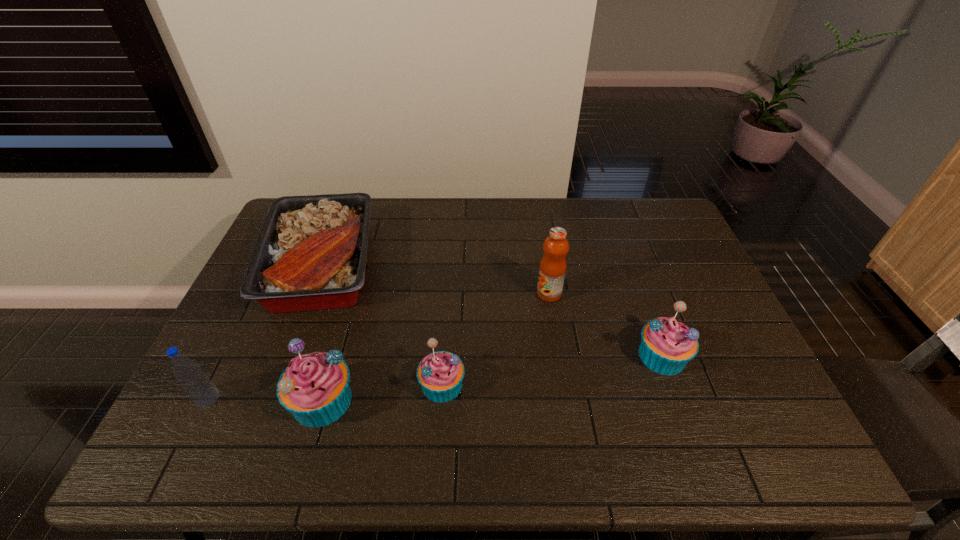
The image size is (960, 540). In order to click on the leftmost muffin in this screenshot , I will do `click(314, 387)`.

You are a GUI agent. You are given a task and a screenshot of the screen. Output one action in this format:
    pyautogui.click(x=<x>, y=<y>)
    Task: Click on the second muffin from right to left
    The width and height of the screenshot is (960, 540).
    Given the screenshot: What is the action you would take?
    pyautogui.click(x=440, y=374)

Where is `the third object from right to left`? This screenshot has width=960, height=540. the third object from right to left is located at coordinates (440, 374).

Find the location of a particular element. This screenshot has width=960, height=540. the rightmost muffin is located at coordinates (667, 345).

The height and width of the screenshot is (540, 960). I want to click on the rightmost object, so click(667, 345).

Locate an element on the screen. The height and width of the screenshot is (540, 960). fruit juice is located at coordinates (552, 270).

Where is `the tallest object`? the tallest object is located at coordinates (552, 270).

Where is `tray`? This screenshot has height=540, width=960. tray is located at coordinates (310, 255).

At what (x,y) coordinates should I click in order to perform the action: click on water bottle. Please return your answer as a coordinate pair (x, y). The image size is (960, 540). Looking at the image, I should click on (195, 382).

Find the location of `free space located on the back of the leftmost muffin`. free space located on the back of the leftmost muffin is located at coordinates (360, 269).